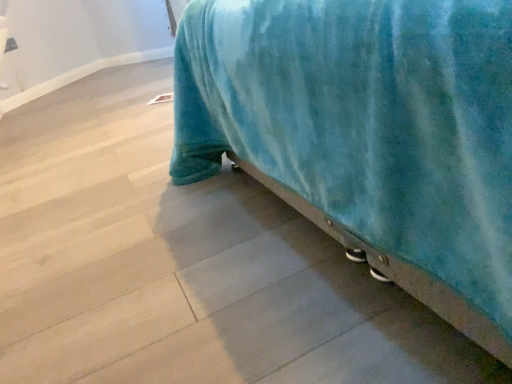
Question: Should I look upward or downward to see velvet blue bed at lower right?

Choices:
 (A) up
 (B) down

Answer: (A)